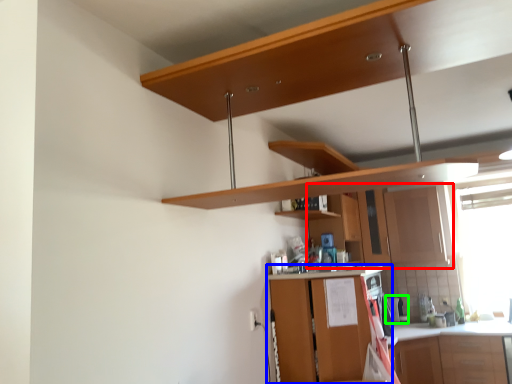
Question: Which object is positioned farthest from cabinetry (highlighted by a red box)? Select from cabinetry (highlighted by a blue box) and appliance (highlighted by a green box).

Choices:
 (A) cabinetry
 (B) appliance

Answer: (A)